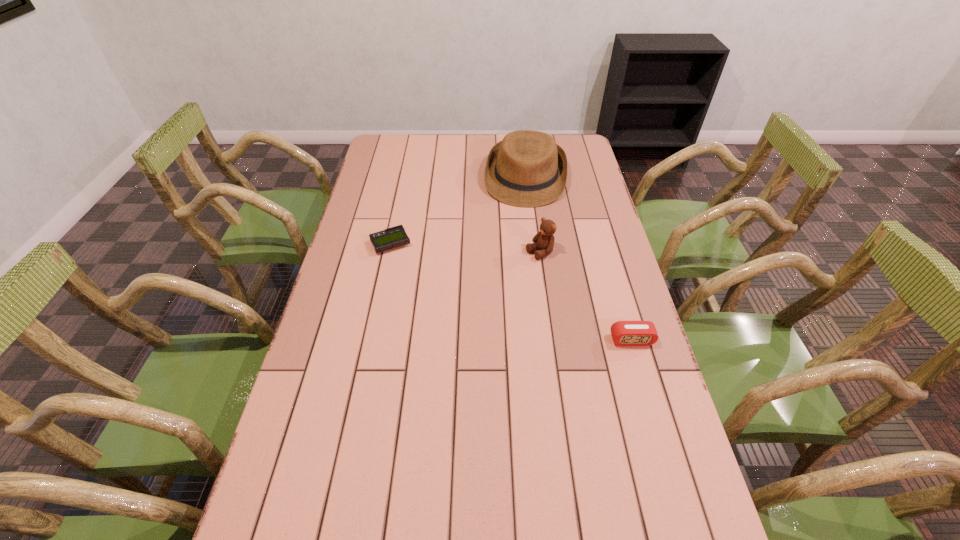
You are a GUI agent. You are given a task and a screenshot of the screen. Output one action in this format:
    pyautogui.click(x=<x>, y=<y>)
    Task: Click on the free space located on the front-facing side of the farthest object
    The width and height of the screenshot is (960, 540).
    Given the screenshot: What is the action you would take?
    pyautogui.click(x=520, y=221)

The image size is (960, 540). What are the coordinates of `free space located 0.160m on the face of the second tallest object` in the screenshot? It's located at (490, 279).

I want to click on free location located 0.330m on the face of the second tallest object, so click(x=444, y=305).

Locate an element on the screen. The image size is (960, 540). free space located on the face of the second tallest object is located at coordinates (468, 291).

Locate an element on the screen. The height and width of the screenshot is (540, 960). object that is positioned at the far edge is located at coordinates (527, 168).

The height and width of the screenshot is (540, 960). Identify the location of object positioned at the left edge. (393, 237).

Where is `alarm clock that is at the right edge`? The width and height of the screenshot is (960, 540). alarm clock that is at the right edge is located at coordinates (624, 333).

This screenshot has height=540, width=960. I want to click on fedora located at the right edge, so click(527, 168).

Image resolution: width=960 pixels, height=540 pixels. I want to click on object present at the far right corner, so click(x=527, y=168).

Where is `vacant space at the left edge of the desktop`? Image resolution: width=960 pixels, height=540 pixels. vacant space at the left edge of the desktop is located at coordinates (x=317, y=360).